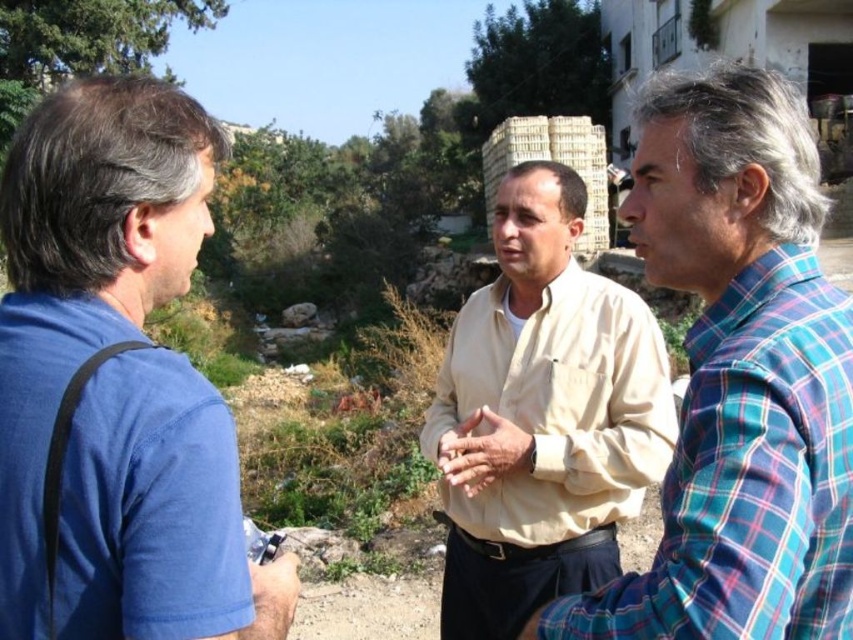
You are a photographer trying to capture a group photo of the blue cotton shirt at left and the plaid cotton shirt at center. Which person should you position closer to the camera to ensure both are in focus?

The blue cotton shirt at left is shorter than the plaid cotton shirt at center, so you should position the blue cotton shirt at left closer to the camera to ensure both are in focus.

You are a photographer trying to capture a photo of the two men in the center. Which man should you focus on first, the plaid cotton shirt at center or the beige cotton shirt at center?

You should focus on the plaid cotton shirt at center first because it is closer to the viewer than the beige cotton shirt at center.

You are a photographer trying to capture a group photo of the blue cotton shirt at left and the beige cotton shirt at center. Since you want everyone to be in focus, you need to know which one is closer to you. Can you tell me which one is nearer?

The blue cotton shirt at left is in front of the beige cotton shirt at center, so it is closer to you.